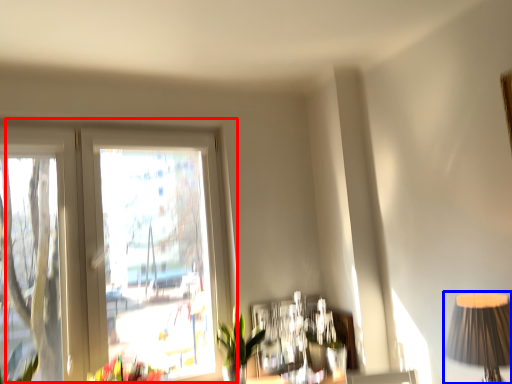
Question: Among these objects, which one is nearest to the camera, window (highlighted by a red box) or table lamp (highlighted by a blue box)?

Choices:
 (A) window
 (B) table lamp

Answer: (B)